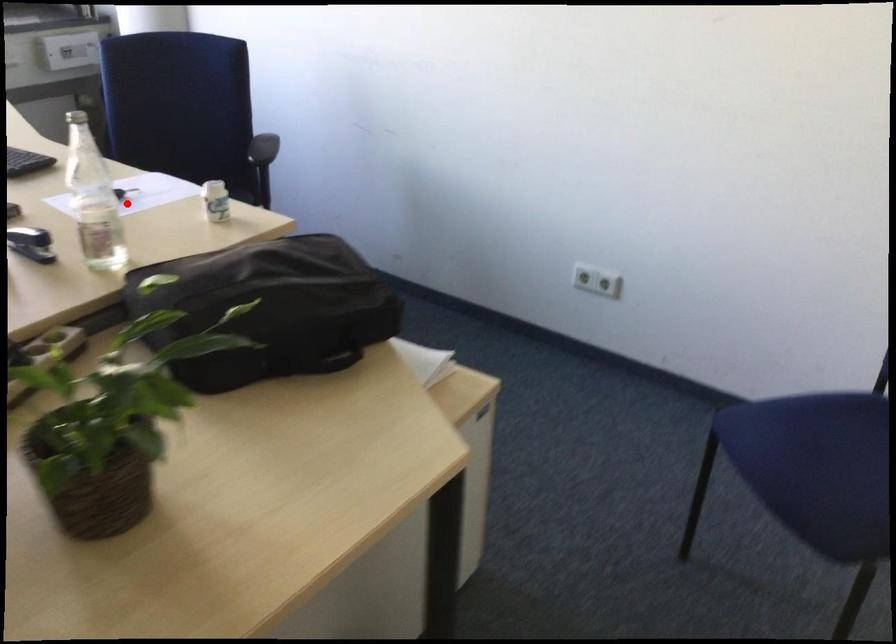
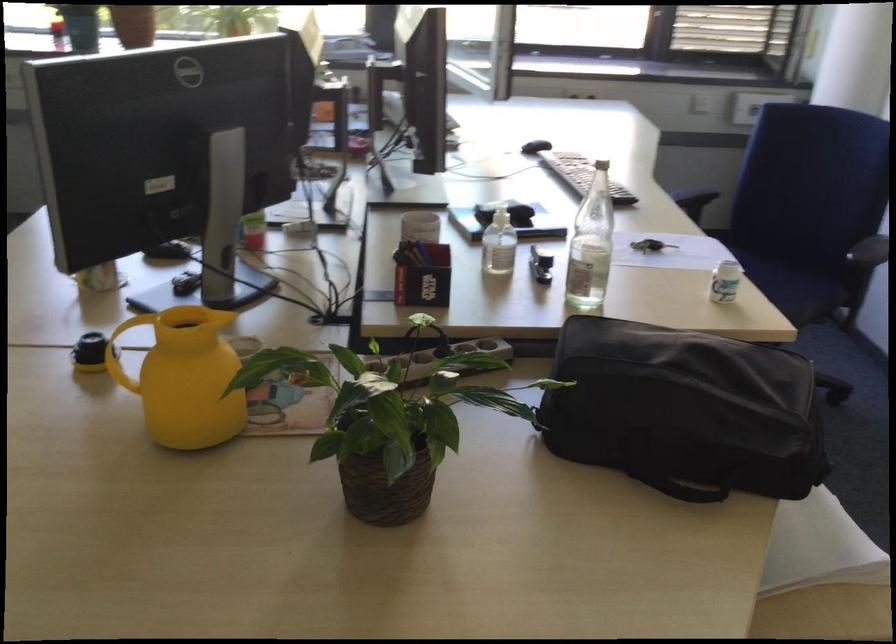
Question: I am providing you with two images of the same scene from different viewpoints. A red point is marked on the first image. At the location where the point appears in image 1, is it still visible in image 2?

Choices:
 (A) Yes
 (B) No

Answer: (A)